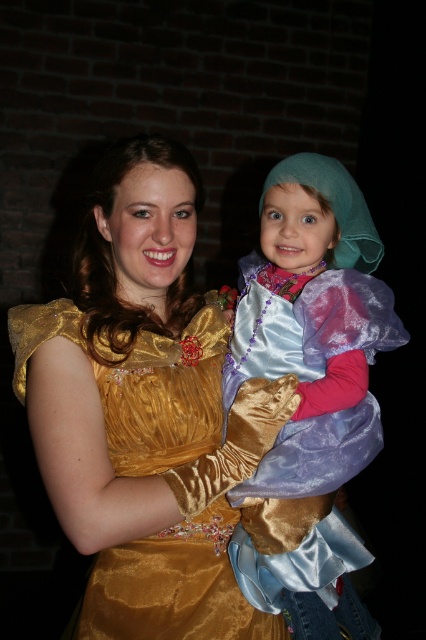
Question: Where is gold satin dress at center located in relation to shiny satin dress at center in the image?

Choices:
 (A) above
 (B) below

Answer: (A)

Question: Which point is closer to the camera?

Choices:
 (A) (244, 486)
 (B) (28, 385)

Answer: (B)

Question: Does gold satin dress at center appear on the left side of shiny satin dress at center?

Choices:
 (A) yes
 (B) no

Answer: (A)

Question: Which point is farther to the camera?

Choices:
 (A) gold satin dress at center
 (B) shiny satin dress at center

Answer: (B)

Question: Does gold satin dress at center appear on the left side of shiny satin dress at center?

Choices:
 (A) no
 (B) yes

Answer: (B)

Question: Which of the following is the closest to the observer?

Choices:
 (A) gold satin dress at center
 (B) shiny satin dress at center

Answer: (A)